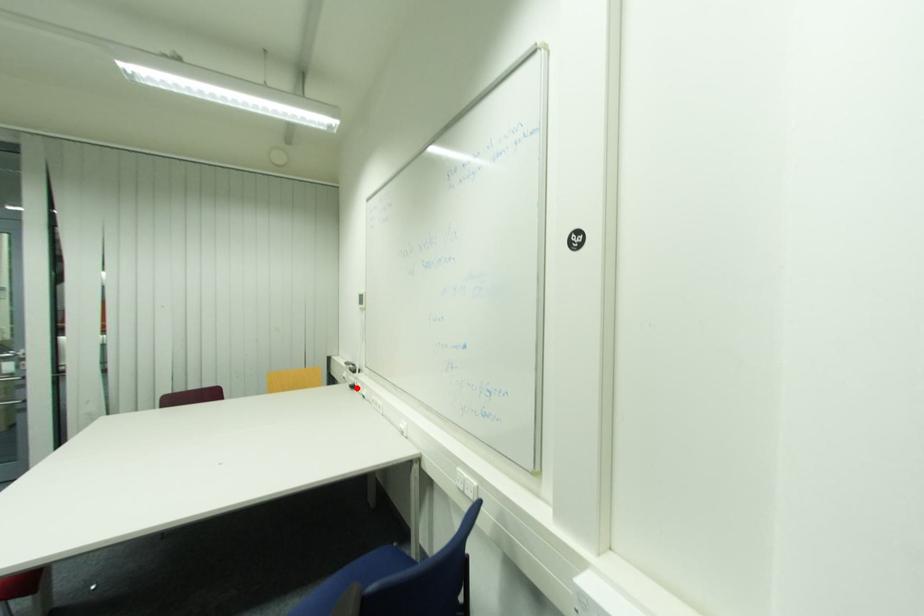
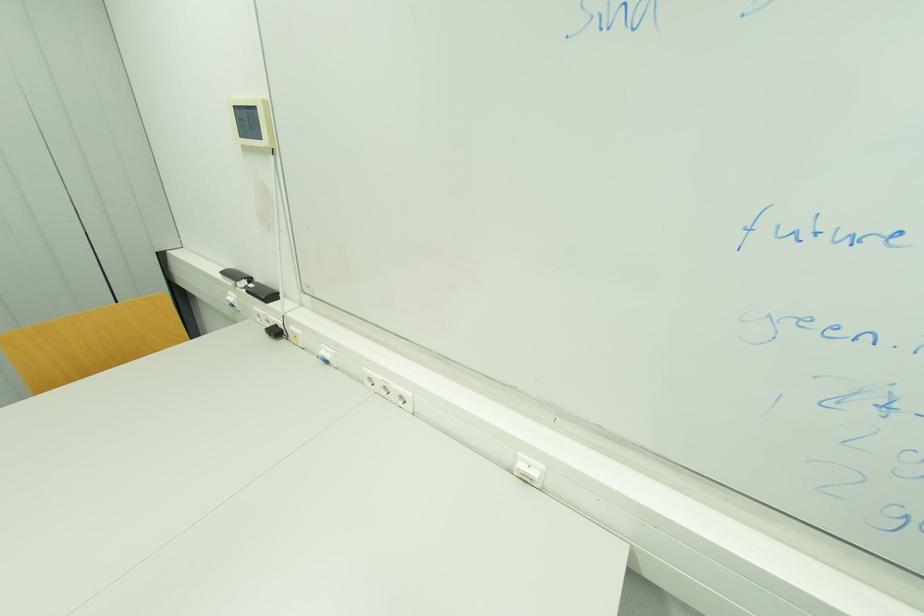
Question: I am providing you with two images of the same scene from different viewpoints. A red point is marked on the first image. Is the red point's position out of view in image 2?

Choices:
 (A) Yes
 (B) No

Answer: (B)